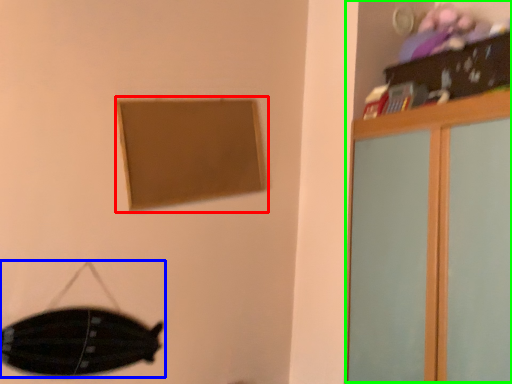
Question: Which object is positioned farthest from picture frame (highlighted by a red box)? Select from swivel chair (highlighted by a blue box) and dresser (highlighted by a green box).

Choices:
 (A) swivel chair
 (B) dresser

Answer: (B)